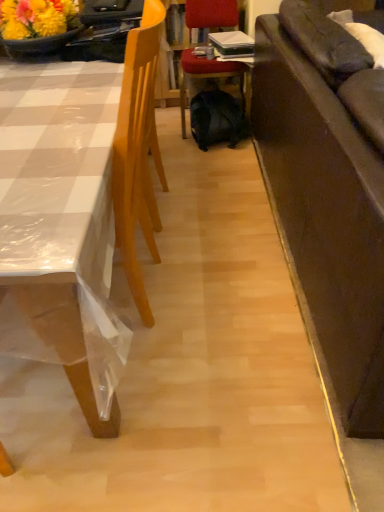
Question: Which direction should I rotate to face velvet red chair at center, placed as the second chair when sorted from left to right, — up or down?

Choices:
 (A) down
 (B) up

Answer: (B)

Question: Does black matte backpack at center have a lesser height compared to light wood chair at left, placed as the first chair when sorted from left to right?

Choices:
 (A) no
 (B) yes

Answer: (B)

Question: Is black matte backpack at center to the right of light wood chair at left, placed as the first chair when sorted from left to right, from the viewer's perspective?

Choices:
 (A) yes
 (B) no

Answer: (A)

Question: Does black matte backpack at center have a greater height compared to light wood chair at left, placed as the first chair when sorted from left to right?

Choices:
 (A) no
 (B) yes

Answer: (A)

Question: From a real-world perspective, does black matte backpack at center stand above light wood chair at left, placed as the first chair when sorted from left to right?

Choices:
 (A) no
 (B) yes

Answer: (A)

Question: Considering the relative sizes of black matte backpack at center and light wood chair at left, the 2th chair when ordered from right to left, in the image provided, is black matte backpack at center wider than light wood chair at left, the 2th chair when ordered from right to left,?

Choices:
 (A) no
 (B) yes

Answer: (A)

Question: From the image's perspective, does black matte backpack at center appear lower than light wood chair at left, the 2th chair when ordered from right to left?

Choices:
 (A) no
 (B) yes

Answer: (A)

Question: Is light wood chair at left, the 2th chair when ordered from right to left, in front of dark brown leather couch at right?

Choices:
 (A) no
 (B) yes

Answer: (A)

Question: Is light wood chair at left, the 2th chair when ordered from right to left, to the right of dark brown leather couch at right from the viewer's perspective?

Choices:
 (A) yes
 (B) no

Answer: (B)

Question: Is light wood chair at left, the 2th chair when ordered from right to left, at the left side of dark brown leather couch at right?

Choices:
 (A) yes
 (B) no

Answer: (A)

Question: Is light wood chair at left, placed as the first chair when sorted from left to right, smaller than dark brown leather couch at right?

Choices:
 (A) yes
 (B) no

Answer: (B)

Question: Is light wood chair at left, placed as the first chair when sorted from left to right, facing towards dark brown leather couch at right?

Choices:
 (A) yes
 (B) no

Answer: (B)

Question: Can you confirm if light wood chair at left, placed as the first chair when sorted from left to right, is bigger than dark brown leather couch at right?

Choices:
 (A) yes
 (B) no

Answer: (A)

Question: From a real-world perspective, is velvet red chair at center, placed as the second chair when sorted from left to right, over dark brown leather couch at right?

Choices:
 (A) yes
 (B) no

Answer: (B)